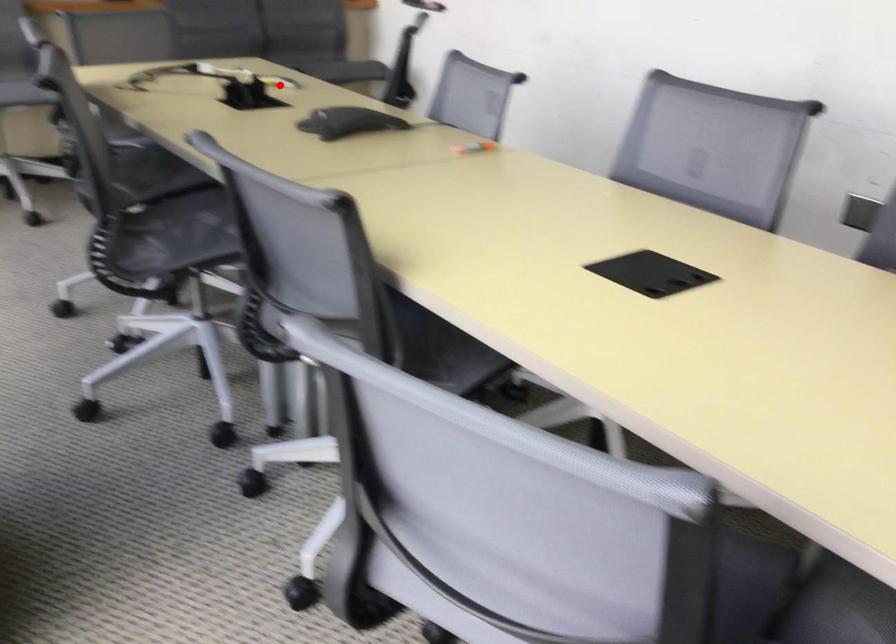
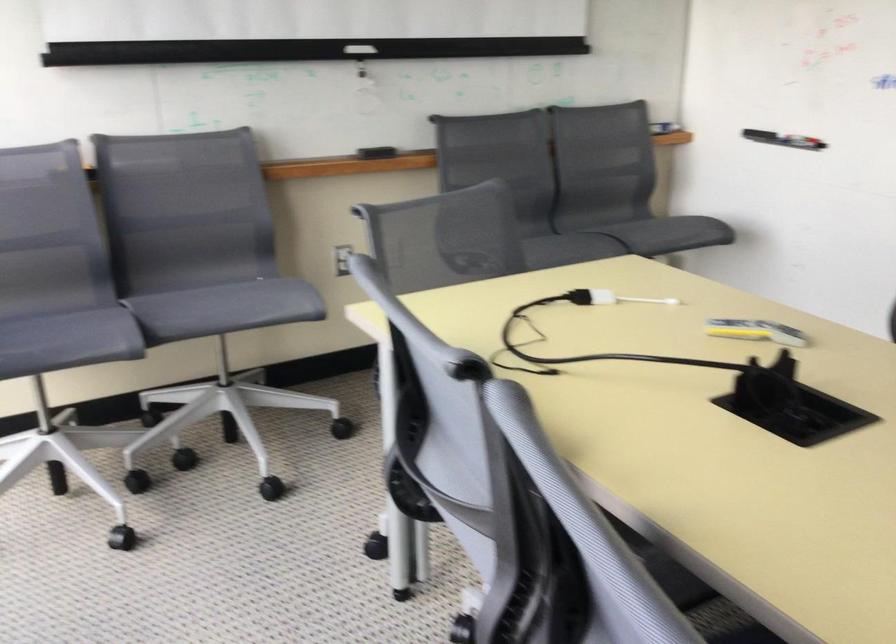
In the second image, find the point that corresponds to the highlighted location in the first image.

(755, 330)